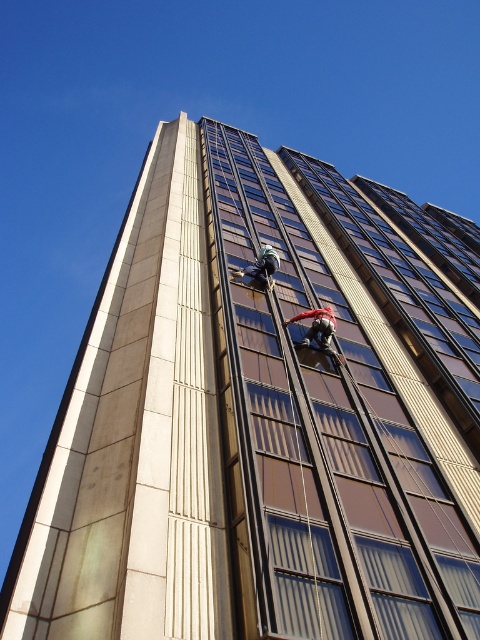
Question: Which point is closer to the camera taking this photo?

Choices:
 (A) (275, 259)
 (B) (313, 330)

Answer: (B)

Question: Is red helmeted worker at center thinner than metallic helmet at center?

Choices:
 (A) no
 (B) yes

Answer: (B)

Question: Does red helmeted worker at center lie in front of metallic helmet at center?

Choices:
 (A) yes
 (B) no

Answer: (A)

Question: Which object appears closest to the camera in this image?

Choices:
 (A) red helmeted worker at center
 (B) metallic helmet at center

Answer: (A)

Question: Does red helmeted worker at center have a larger size compared to metallic helmet at center?

Choices:
 (A) yes
 (B) no

Answer: (B)